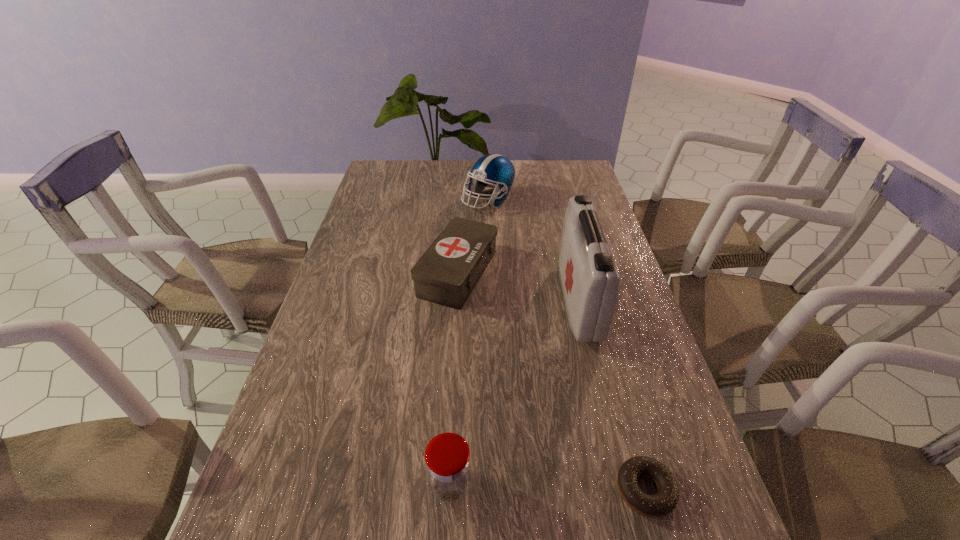
Find the location of a particular element. The width and height of the screenshot is (960, 540). vacant space located on the front side of the taller first-aid kit is located at coordinates (445, 301).

Locate an element on the screen. This screenshot has width=960, height=540. free location located at the front of the second tallest object with the faceguard is located at coordinates pyautogui.click(x=489, y=229).

Locate an element on the screen. The width and height of the screenshot is (960, 540). free region located on the left of the jar is located at coordinates (252, 484).

At what (x,y) coordinates should I click in order to perform the action: click on vacant area located on the front of the shorter first-aid kit. Please return your answer as a coordinate pair (x, y). Image resolution: width=960 pixels, height=540 pixels. Looking at the image, I should click on (454, 335).

Where is `blank space located on the left of the shortest object`? Image resolution: width=960 pixels, height=540 pixels. blank space located on the left of the shortest object is located at coordinates (408, 490).

This screenshot has height=540, width=960. What are the coordinates of `object positioned at the far edge` in the screenshot? It's located at (495, 171).

Locate an element on the screen. the first-aid kit that is at the right edge is located at coordinates (589, 279).

I want to click on doughnut that is positioned at the right edge, so click(x=662, y=503).

In the image, there is a desktop. Where is `vacant space at the far edge`? The width and height of the screenshot is (960, 540). vacant space at the far edge is located at coordinates (526, 164).

At what (x,y) coordinates should I click in order to perform the action: click on vacant space at the left edge of the desktop. Please return your answer as a coordinate pair (x, y). Looking at the image, I should click on (358, 380).